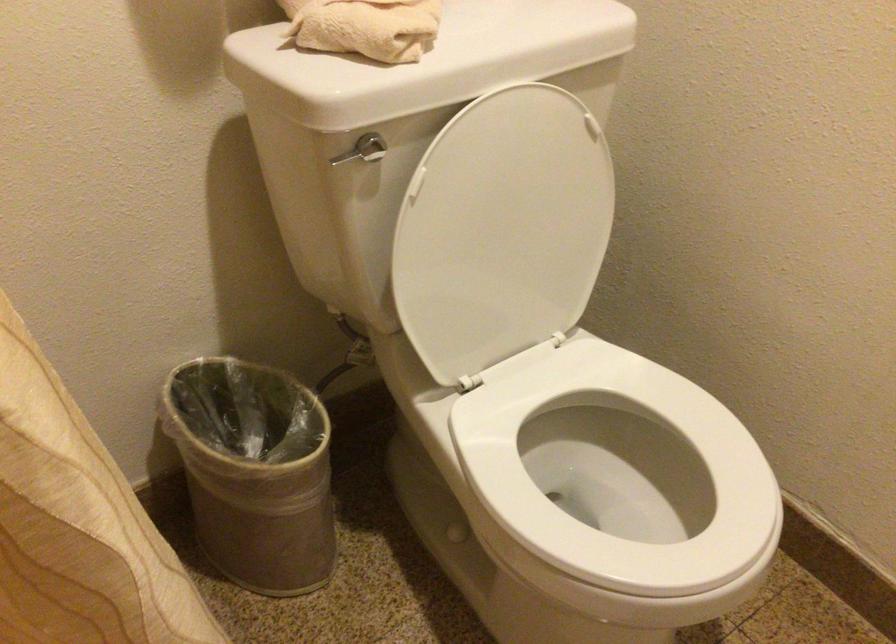
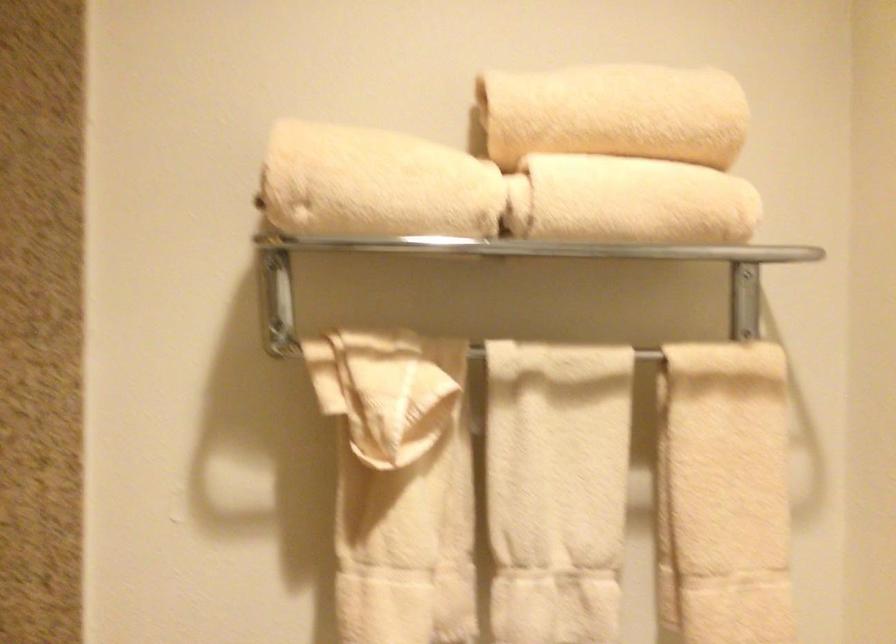
First-person continuous shooting, in which direction is the camera rotating?

The camera's rotation is toward left-up.